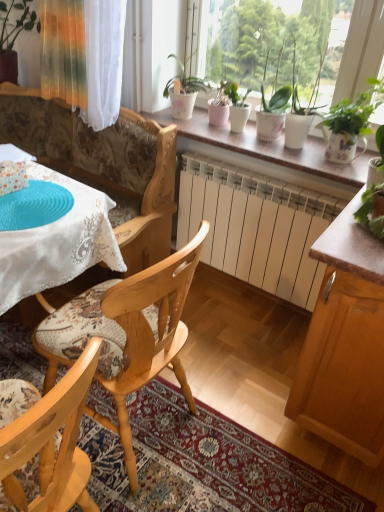
Question: Should I look upward or downward to see white ceramic pots at center?

Choices:
 (A) down
 (B) up

Answer: (B)

Question: Would you say wooden placemat at lower center is outside matte brown cabinet at right?

Choices:
 (A) no
 (B) yes

Answer: (B)

Question: Is wooden placemat at lower center taller than matte brown cabinet at right?

Choices:
 (A) yes
 (B) no

Answer: (B)

Question: Is wooden placemat at lower center thinner than matte brown cabinet at right?

Choices:
 (A) yes
 (B) no

Answer: (B)

Question: From a real-world perspective, is wooden placemat at lower center located higher than matte brown cabinet at right?

Choices:
 (A) no
 (B) yes

Answer: (A)

Question: Could you tell me if wooden placemat at lower center is facing matte brown cabinet at right?

Choices:
 (A) yes
 (B) no

Answer: (B)

Question: Is wooden placemat at lower center looking in the opposite direction of matte brown cabinet at right?

Choices:
 (A) yes
 (B) no

Answer: (B)

Question: Does translucent glass vase at upper left, the first houseplant viewed from the back, turn towards light wood chair at center, positioned as the 1th chair in front-to-back order?

Choices:
 (A) yes
 (B) no

Answer: (B)

Question: Does translucent glass vase at upper left, positioned as the 3th houseplant in bottom-to-top order, have a lesser width compared to light wood chair at center, which appears as the second chair when viewed from the back?

Choices:
 (A) no
 (B) yes

Answer: (B)

Question: Would you say translucent glass vase at upper left, which ranks as the 1th houseplant in top-to-bottom order, is a long distance from light wood chair at center, which appears as the second chair when viewed from the back?

Choices:
 (A) yes
 (B) no

Answer: (A)

Question: From a real-world perspective, is translucent glass vase at upper left, which ranks as the 1th houseplant in top-to-bottom order, positioned under light wood chair at center, which appears as the second chair when viewed from the back, based on gravity?

Choices:
 (A) yes
 (B) no

Answer: (B)

Question: Is light wood chair at center, which appears as the second chair when viewed from the back, completely or partially inside translucent glass vase at upper left, the first houseplant viewed from the back?

Choices:
 (A) yes
 (B) no

Answer: (B)

Question: From a real-world perspective, is translucent glass vase at upper left, positioned as the 3th houseplant in bottom-to-top order, on top of light wood chair at center, which appears as the second chair when viewed from the back?

Choices:
 (A) yes
 (B) no

Answer: (A)

Question: Does light wood chair at center, which ranks as the second chair in front-to-back order, appear on the right side of translucent glass vase at upper left, the third houseplant when ordered from right to left?

Choices:
 (A) no
 (B) yes

Answer: (B)